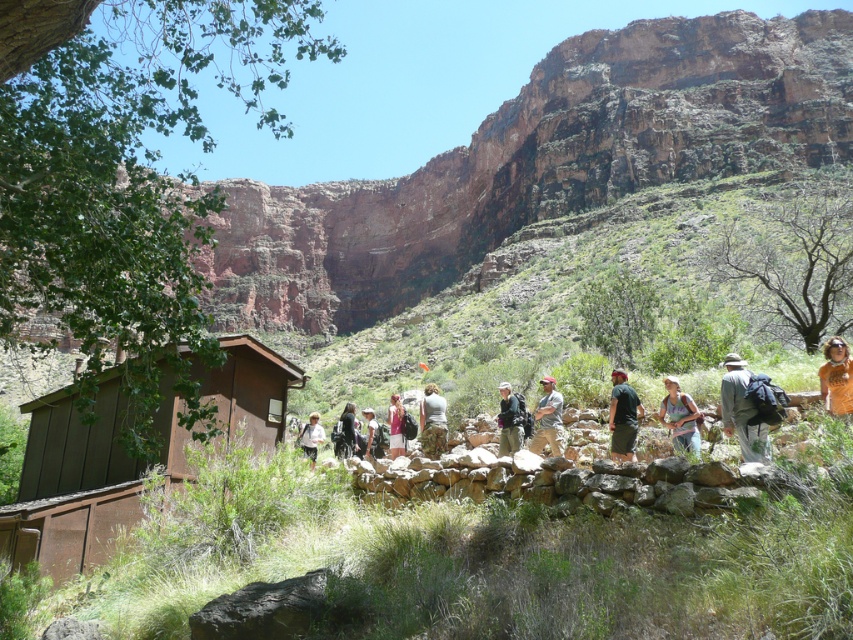
Is point (628, 456) positioned before point (401, 413)?

Yes, point (628, 456) is closer to viewer.

Describe the element at coordinates (624, 417) in the screenshot. I see `green fabric pants at center` at that location.

In order to click on green fabric pants at center in this screenshot , I will do `click(624, 417)`.

Is point (672, 397) closer to viewer compared to point (373, 428)?

Yes, it is.

You are a GUI agent. You are given a task and a screenshot of the screen. Output one action in this format:
    pyautogui.click(x=<x>, y=<y>)
    Task: Click on the green fabric backpack at center
    The width and height of the screenshot is (853, 640).
    Given the screenshot: What is the action you would take?
    pyautogui.click(x=679, y=417)

Who is taller, orange cotton shirt at center or camouflage pants at center?

Standing taller between the two is camouflage pants at center.

How much distance is there between orange cotton shirt at center and camouflage pants at center?

28.96 meters

Who is more distant from viewer, (838, 394) or (430, 406)?

Positioned behind is point (430, 406).

Where is `orange cotton shirt at center`? orange cotton shirt at center is located at coordinates pos(836,376).